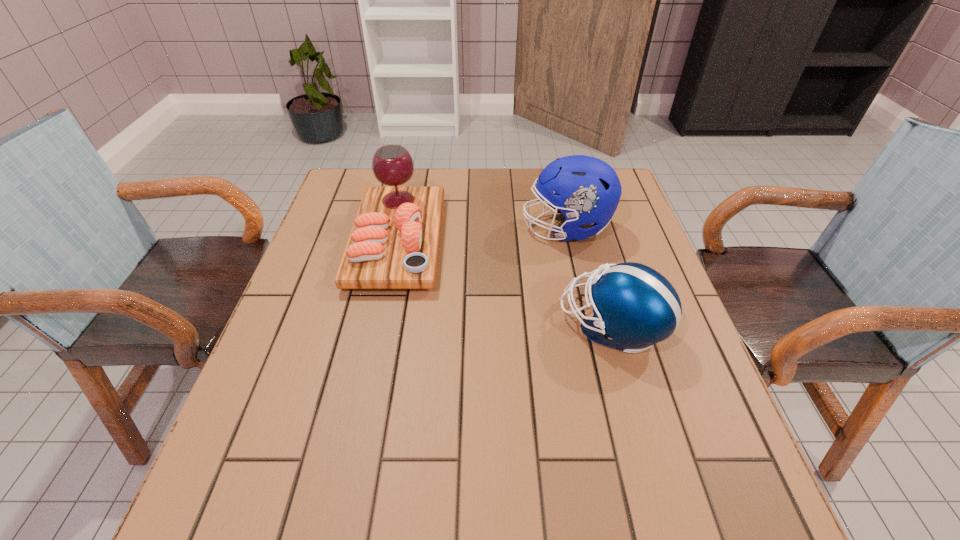
At what (x,y) coordinates should I click in order to perform the action: click on the taller football helmet. Please return your answer as a coordinate pair (x, y). Looking at the image, I should click on (587, 190).

Locate an element on the screen. the leftmost object is located at coordinates (394, 242).

Where is `the nearer football helmet`? The width and height of the screenshot is (960, 540). the nearer football helmet is located at coordinates point(634,306).

This screenshot has height=540, width=960. I want to click on the shortest object, so click(x=634, y=306).

This screenshot has width=960, height=540. I want to click on blank space located on the face guard of the taller football helmet, so click(x=402, y=228).

The height and width of the screenshot is (540, 960). I want to click on vacant region located on the face guard of the taller football helmet, so click(x=427, y=228).

I want to click on vacant space situated on the face guard of the taller football helmet, so click(392, 228).

Image resolution: width=960 pixels, height=540 pixels. Identify the location of vacant space located 0.050m on the front of the leftmost object. (383, 311).

This screenshot has height=540, width=960. Identify the location of free region located at the front of the shortest object with the faceguard. (393, 326).

The height and width of the screenshot is (540, 960). In order to click on free spot located 0.160m at the front of the shortest object with the faceguard in this screenshot , I will do `click(489, 326)`.